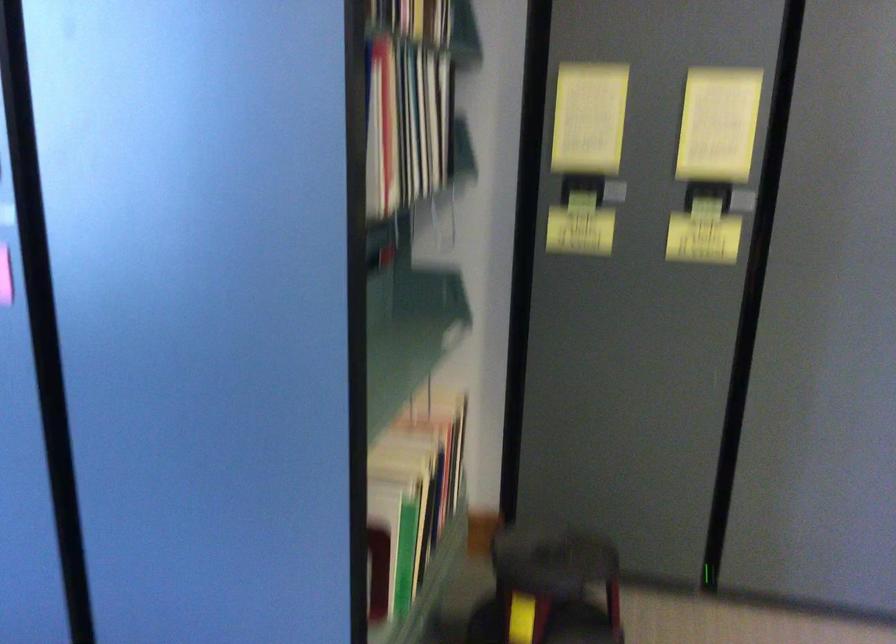
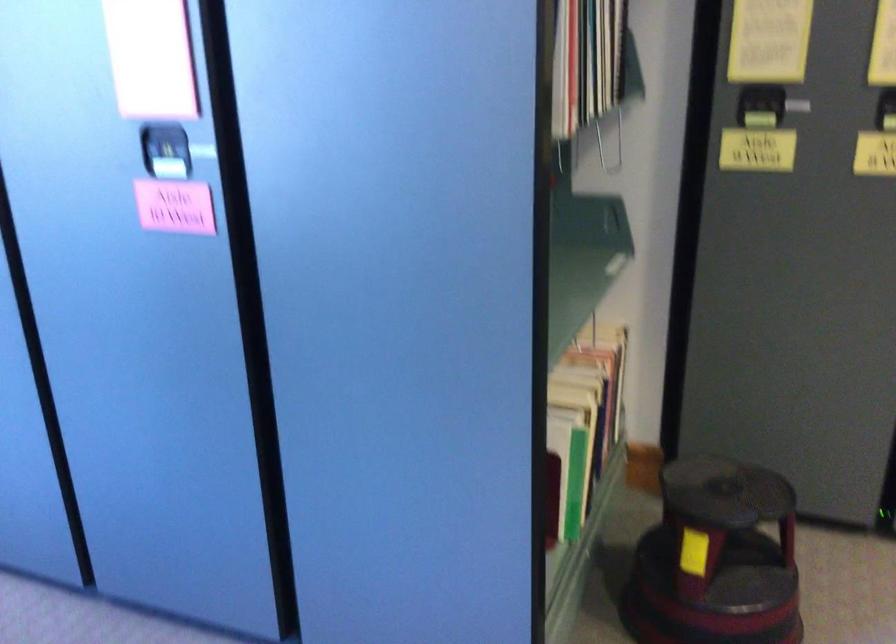
Question: What movement of the cameraman would produce the second image?

Choices:
 (A) Left
 (B) Right
 (C) Forward
 (D) Backward

Answer: (A)